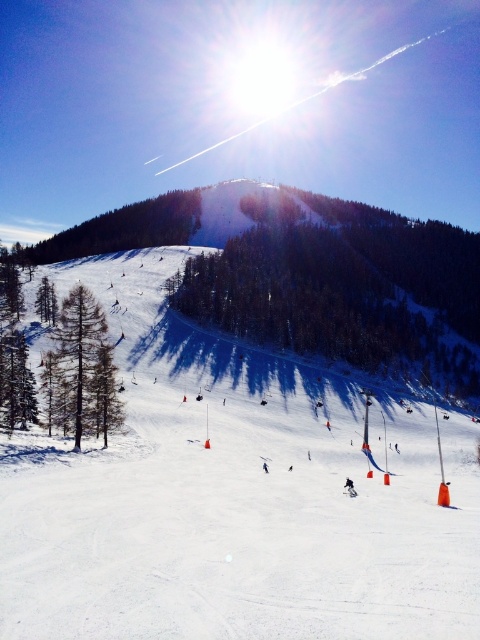
Between brown matte tree at left and green matte tree at upper left, which one appears on the right side from the viewer's perspective?

brown matte tree at left is more to the right.

Measure the distance between brown matte tree at left and camera.

The distance of brown matte tree at left from camera is 64.28 meters.

Where is `brown matte tree at left`? The height and width of the screenshot is (640, 480). brown matte tree at left is located at coordinates (82, 371).

Who is higher up, white snow ski slope at center or green textured tree at center?

Positioned higher is green textured tree at center.

Who is more forward, (466, 518) or (304, 328)?

Positioned in front is point (466, 518).

Image resolution: width=480 pixels, height=640 pixels. I want to click on white snow ski slope at center, so click(x=232, y=496).

Does green textured tree at center have a smaller size compared to white matte ski at center?

No.

Between green textured tree at center and white matte ski at center, which one is positioned higher?

green textured tree at center

Does point (266, 193) lie in front of point (347, 488)?

No.

The image size is (480, 640). In order to click on green textured tree at center in this screenshot , I will do `click(340, 282)`.